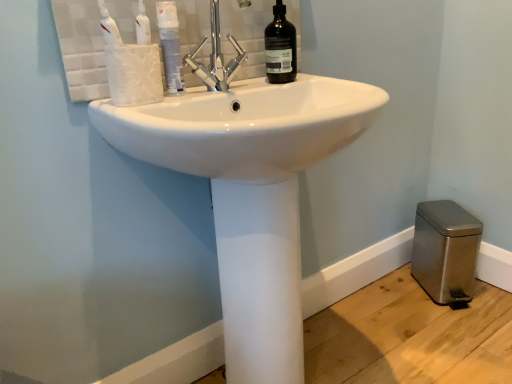
Question: Is white glossy sink at center shorter than white glossy mouthwash at upper center?

Choices:
 (A) yes
 (B) no

Answer: (B)

Question: Is white glossy sink at center wider than white glossy mouthwash at upper center?

Choices:
 (A) no
 (B) yes

Answer: (B)

Question: Is white glossy sink at center outside of white glossy mouthwash at upper center?

Choices:
 (A) no
 (B) yes

Answer: (B)

Question: Does white glossy sink at center have a smaller size compared to white glossy mouthwash at upper center?

Choices:
 (A) no
 (B) yes

Answer: (A)

Question: Is white glossy sink at center thinner than white glossy mouthwash at upper center?

Choices:
 (A) yes
 (B) no

Answer: (B)

Question: From the image's perspective, is white glossy sink at center above white glossy mouthwash at upper center?

Choices:
 (A) no
 (B) yes

Answer: (A)

Question: Is white glossy mouthwash at upper center behind white glossy sink at center?

Choices:
 (A) no
 (B) yes

Answer: (B)

Question: Does white glossy mouthwash at upper center come in front of white glossy sink at center?

Choices:
 (A) no
 (B) yes

Answer: (A)

Question: Is white glossy mouthwash at upper center outside white glossy sink at center?

Choices:
 (A) no
 (B) yes

Answer: (B)

Question: Considering the relative sizes of white glossy mouthwash at upper center and white glossy sink at center in the image provided, is white glossy mouthwash at upper center wider than white glossy sink at center?

Choices:
 (A) yes
 (B) no

Answer: (B)

Question: From the image's perspective, is white glossy mouthwash at upper center beneath white glossy sink at center?

Choices:
 (A) no
 (B) yes

Answer: (A)

Question: Does white glossy mouthwash at upper center turn towards white glossy sink at center?

Choices:
 (A) no
 (B) yes

Answer: (A)

Question: Considering the relative sizes of white glossy mouthwash at upper center and black glass bottle at upper center in the image provided, is white glossy mouthwash at upper center smaller than black glass bottle at upper center?

Choices:
 (A) no
 (B) yes

Answer: (B)